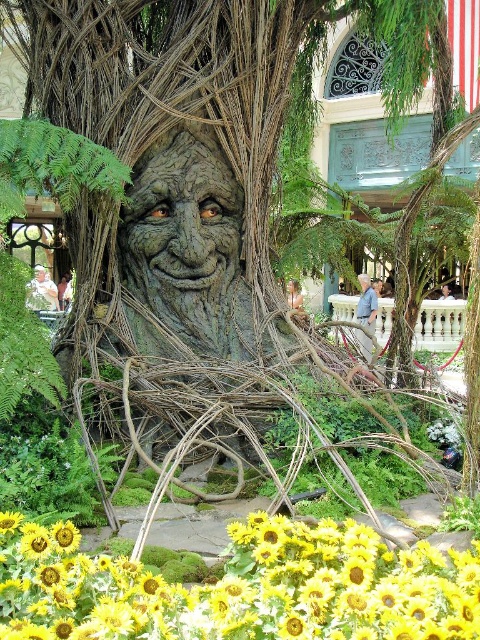
Consider the image. Is yellow matte sunflower at center further to the viewer compared to green mossy tree trunk at center?

No, yellow matte sunflower at center is in front of green mossy tree trunk at center.

Between point (275, 518) and point (192, 227), which one is positioned behind?

Point (192, 227)

Is point (211, 624) closer to viewer compared to point (187, 228)?

That is True.

At what (x,y) coordinates should I click in order to perform the action: click on yellow matte sunflower at center. Please return your answer as a coordinate pair (x, y). This screenshot has height=640, width=480. Looking at the image, I should click on pyautogui.click(x=240, y=588).